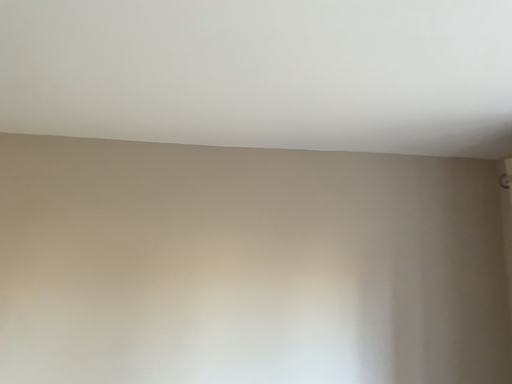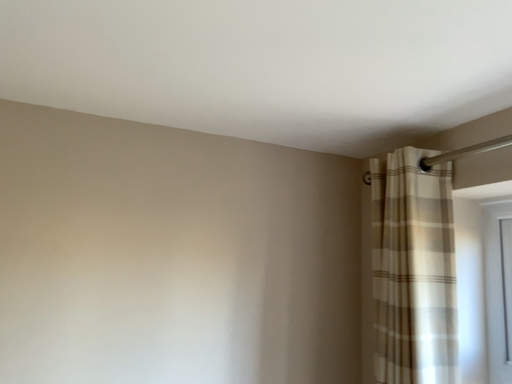
Question: How did the camera likely rotate when shooting the video?

Choices:
 (A) rotated left
 (B) rotated right

Answer: (B)